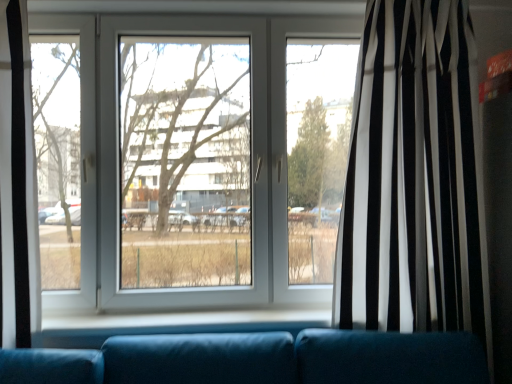
Question: Does point (417, 279) appear closer or farther from the camera than point (266, 54)?

Choices:
 (A) farther
 (B) closer

Answer: (B)

Question: Considering their positions, is black/white striped curtain at right located in front of or behind transparent glass window at center?

Choices:
 (A) behind
 (B) front

Answer: (B)

Question: From a real-world perspective, is black/white striped curtain at right positioned above or below transparent glass window at center?

Choices:
 (A) above
 (B) below

Answer: (B)

Question: Is transparent glass window at center wider or thinner than black/white striped curtain at right?

Choices:
 (A) wide
 (B) thin

Answer: (B)

Question: Is transparent glass window at center spatially inside black/white striped curtain at right, or outside of it?

Choices:
 (A) outside
 (B) inside

Answer: (A)

Question: From their relative heights in the image, would you say transparent glass window at center is taller or shorter than black/white striped curtain at right?

Choices:
 (A) tall
 (B) short

Answer: (B)

Question: From the image's perspective, is transparent glass window at center above or below black/white striped curtain at right?

Choices:
 (A) above
 (B) below

Answer: (A)